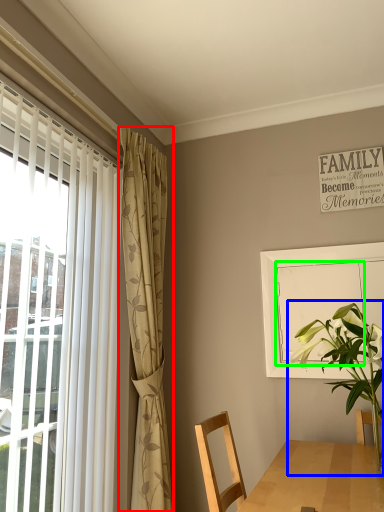
Question: Which is farther away from curtain (highlighted by a red box)? houseplant (highlighted by a blue box) or screen door (highlighted by a green box)?

Choices:
 (A) houseplant
 (B) screen door

Answer: (A)